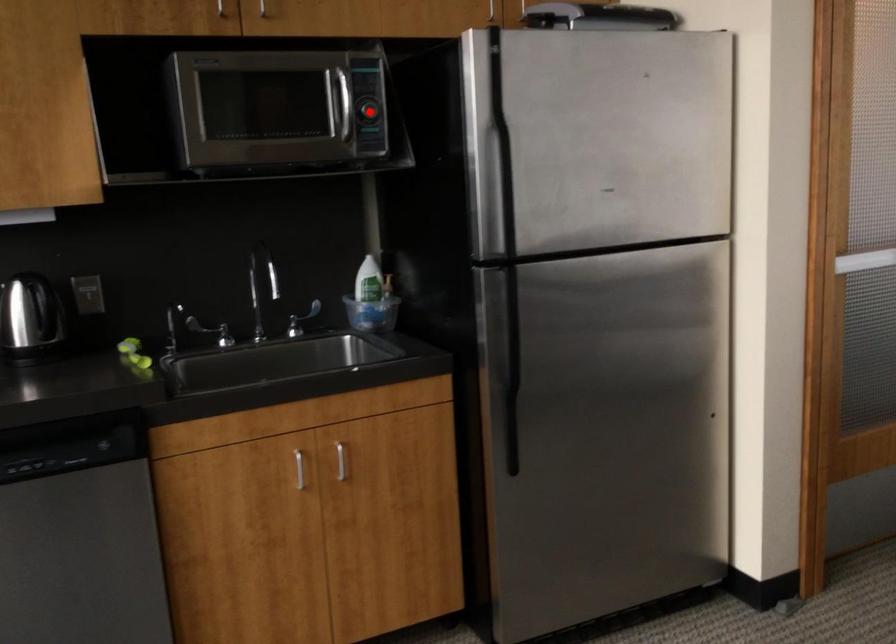
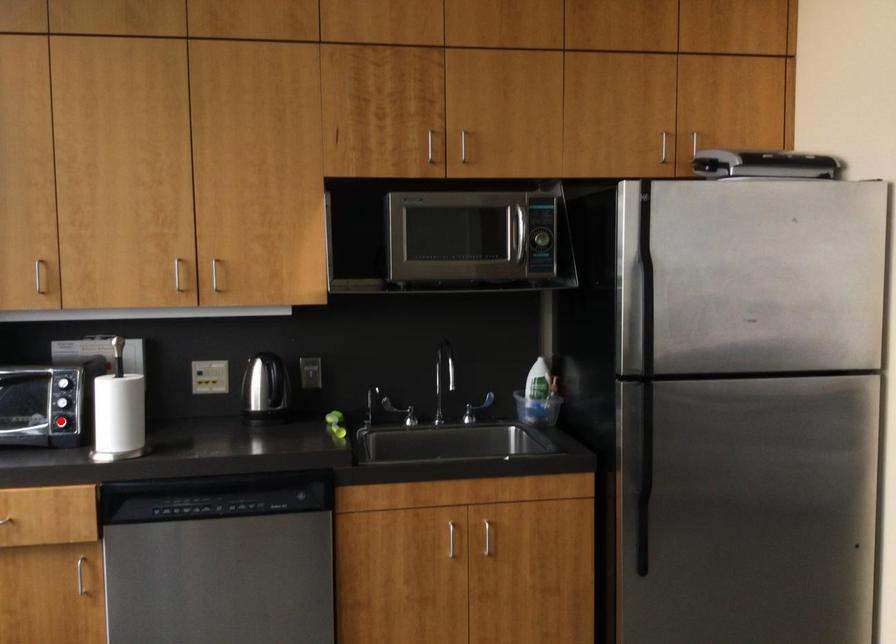
I am providing you with two images of the same scene from different viewpoints. A red point is marked on the first image and another point is marked on the second image. Do the highlighted points in image1 and image2 indicate the same real-world spot?

No